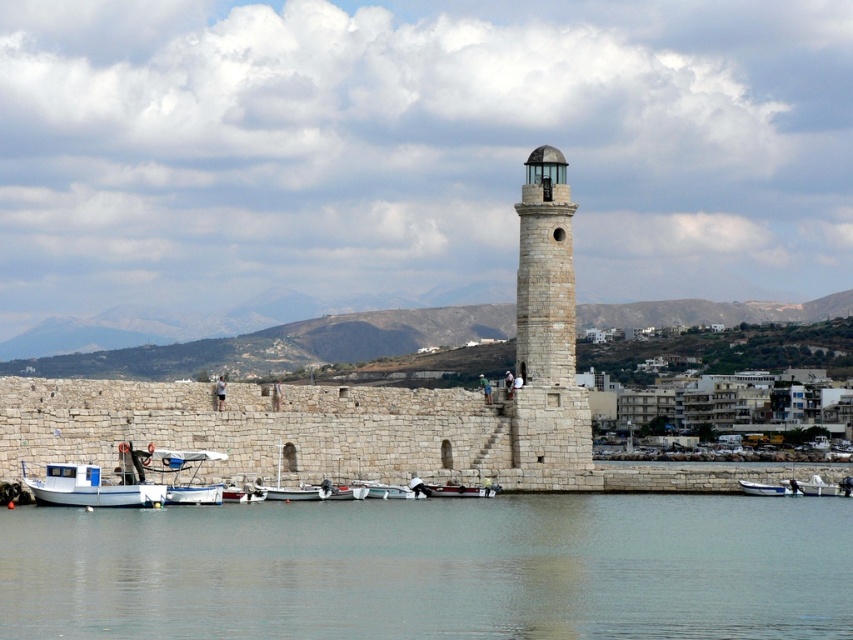
You are standing at the point marked by point (433, 568). What is the nearest object to you in the scene?

The nearest object to you is clear water at lower center, as it is represented by the point (433, 568).

You are standing on the pier and want to take a photo of the white matte boat at center. To avoid including the clear water at lower center in the photo, should you move forward or backward?

Since the clear water at lower center is closer to the viewer than the white matte boat at center, moving forward would bring the boat into focus while the water moves out of the frame. Therefore, you should move forward to avoid including the clear water at lower center in the photo.

You are a photographer planning to take a photo of the white glossy boat at lower right and the white matte boat at lower right from the pier. Which boat should you focus on first if you want to capture the taller vessel?

The white glossy boat at lower right is taller than the white matte boat at lower right, so you should focus on the white glossy boat at lower right first.